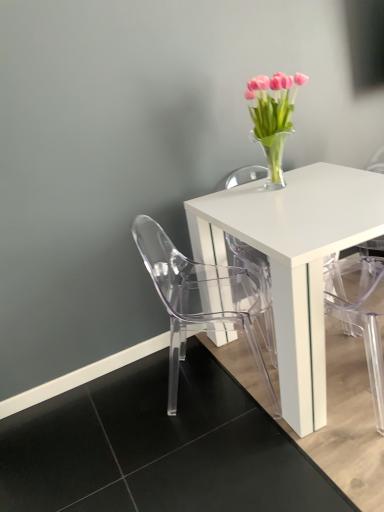
Identify the location of vacant location below pink glass vase at upper right (from a real-world perspective). This screenshot has width=384, height=512. (280, 185).